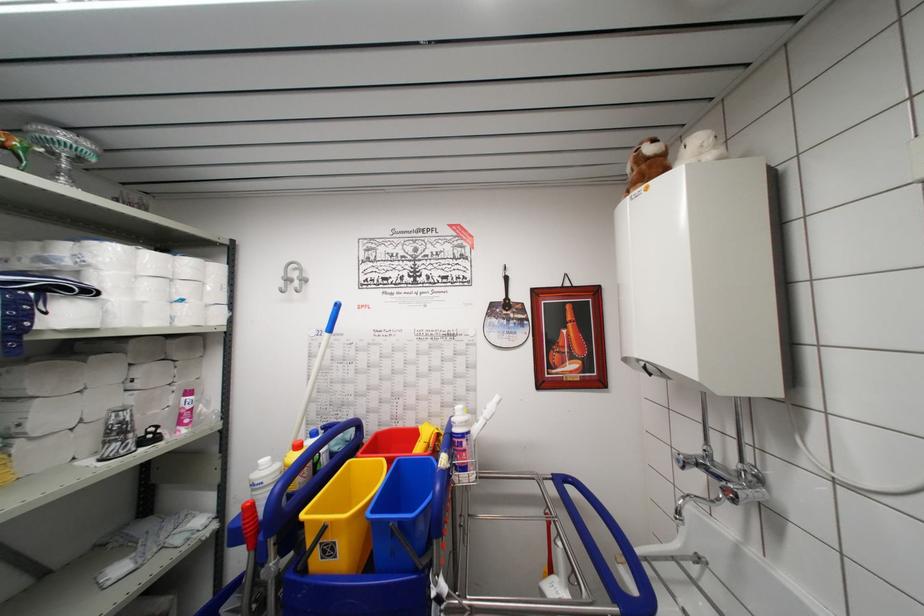
At what (x,y) coordinates should I click in order to perform the action: click on white cleaning bottle. Please return your answer as a coordinate pair (x, y). The width and height of the screenshot is (924, 616). Looking at the image, I should click on (263, 480).